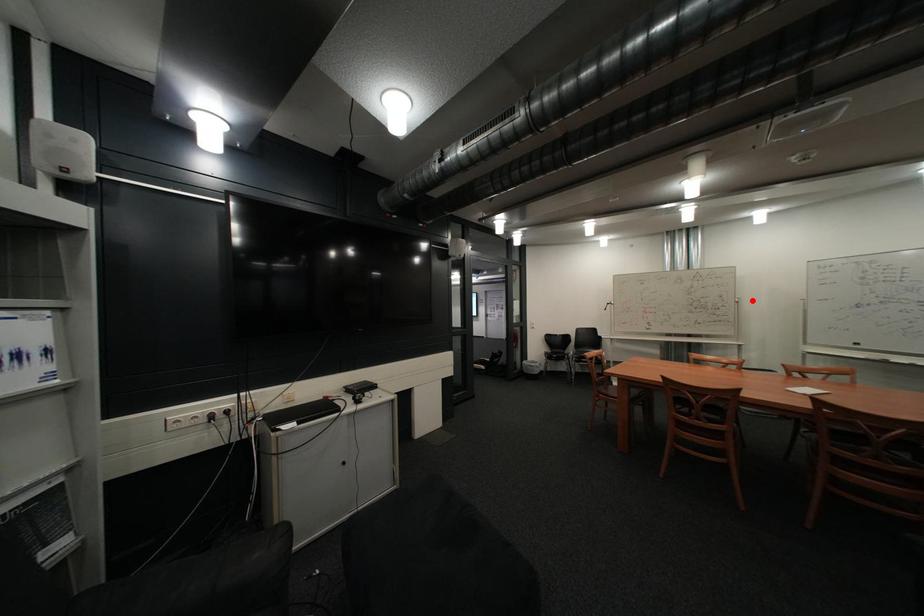
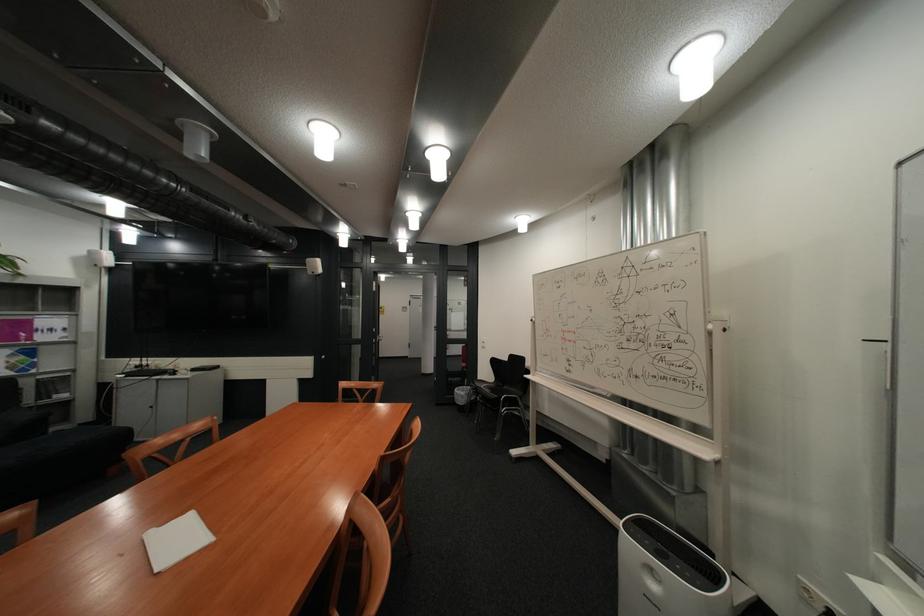
Find the pixel in the second image that matches the highlighted location in the first image.

(725, 326)